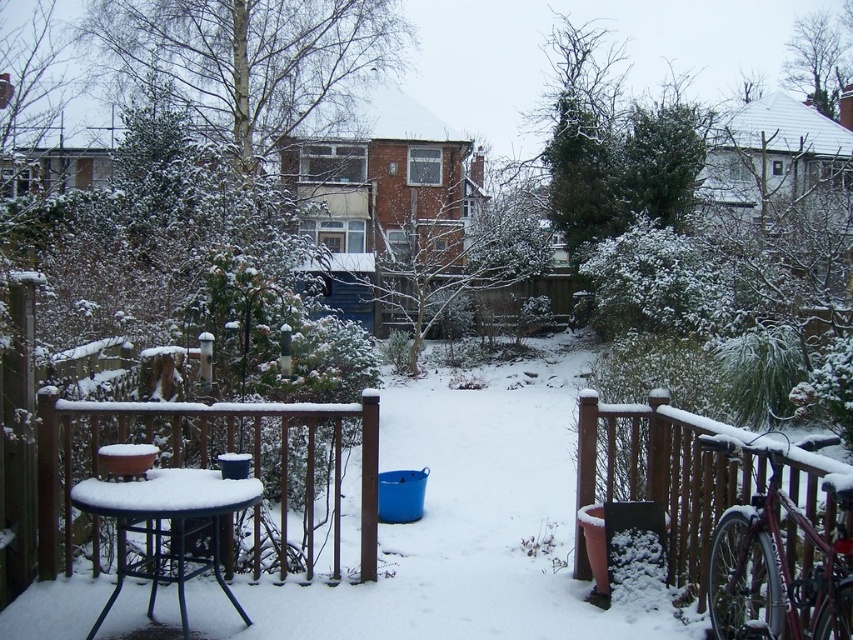
Can you confirm if brown wooden fence at center is bigger than black metal table at lower left?

Yes.

Can you confirm if brown wooden fence at center is smaller than black metal table at lower left?

Incorrect, brown wooden fence at center is not smaller in size than black metal table at lower left.

The width and height of the screenshot is (853, 640). In order to click on brown wooden fence at center in this screenshot , I will do tap(212, 460).

This screenshot has height=640, width=853. In order to click on brown wooden fence at center in this screenshot , I will do `click(212, 460)`.

This screenshot has height=640, width=853. What are the coordinates of `brown wooden fence at lower right` in the screenshot? It's located at (695, 477).

Is brown wooden fence at lower right wider than black metal table at lower left?

Correct, the width of brown wooden fence at lower right exceeds that of black metal table at lower left.

Where is `brown wooden fence at lower right`? The height and width of the screenshot is (640, 853). brown wooden fence at lower right is located at coordinates (695, 477).

Is point (677, 541) behind point (310, 499)?

Yes, it is behind point (310, 499).

Describe the element at coordinates (695, 477) in the screenshot. I see `brown wooden fence at lower right` at that location.

Where is `brown wooden fence at lower right`? The image size is (853, 640). brown wooden fence at lower right is located at coordinates (695, 477).